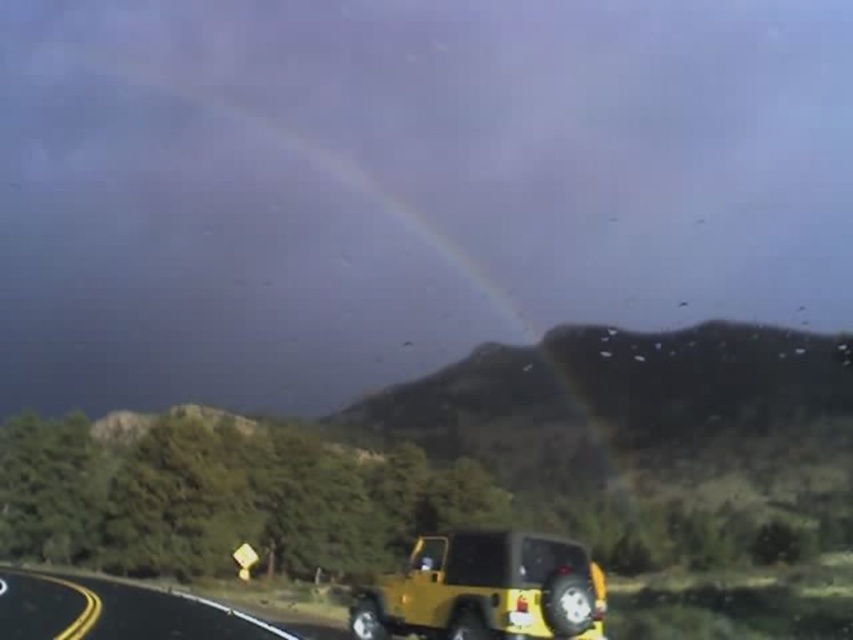
Consider the image. Who is more forward, (519, 604) or (90, 627)?

Point (519, 604)

Does yellow matte jeep at lower right have a smaller size compared to yellow matte highway at lower left?

Indeed, yellow matte jeep at lower right has a smaller size compared to yellow matte highway at lower left.

Who is more forward, [408,580] or [175,630]?

Point [408,580] is more forward.

You are a GUI agent. You are given a task and a screenshot of the screen. Output one action in this format:
    pyautogui.click(x=<x>, y=<y>)
    Task: Click on the yellow matte jeep at lower right
    
    Given the screenshot: What is the action you would take?
    pyautogui.click(x=483, y=589)